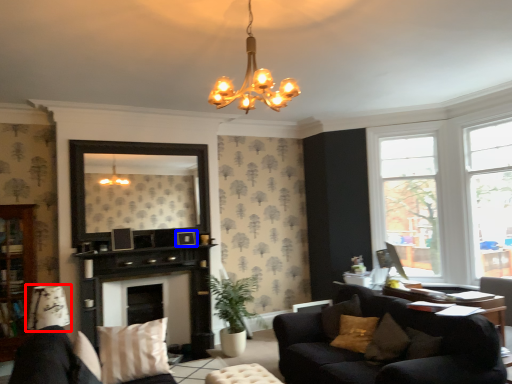
Question: Among these objects, which one is nearest to the camera, lamp (highlighted by a red box) or picture frame (highlighted by a blue box)?

Choices:
 (A) lamp
 (B) picture frame

Answer: (A)